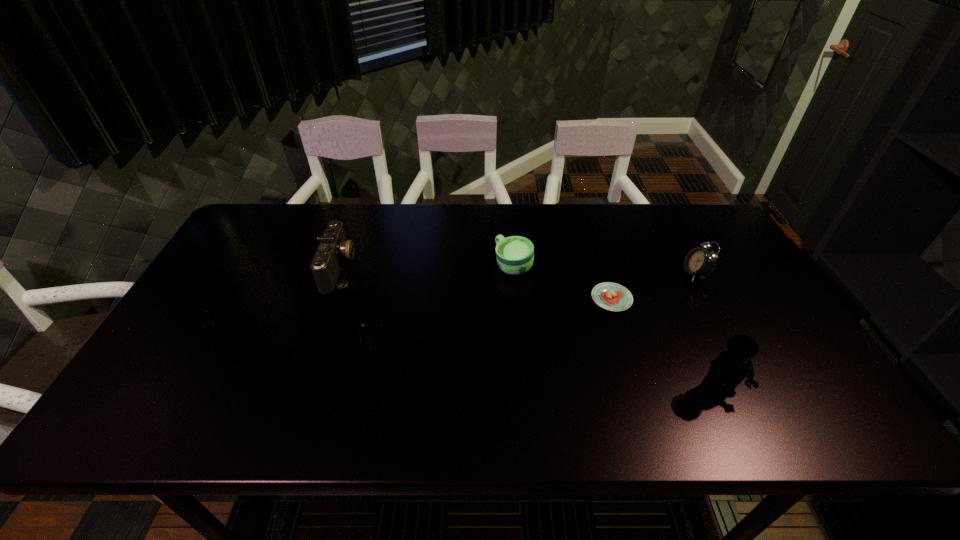
This screenshot has height=540, width=960. What are the coordinates of `the third object from right to left` in the screenshot? It's located at (611, 296).

At what (x,y) coordinates should I click in order to perform the action: click on the shortest object. Please return your answer as a coordinate pair (x, y). The height and width of the screenshot is (540, 960). Looking at the image, I should click on (611, 296).

Where is `vacant area situated 0.100m on the front-facing side of the shortest Lego`? vacant area situated 0.100m on the front-facing side of the shortest Lego is located at coordinates (171, 332).

Identify the location of vacant point located on the front-facing side of the second Lego from left to right. This screenshot has height=540, width=960. (441, 350).

Find the location of a particular element. This screenshot has width=960, height=540. free spot located 0.160m on the front-facing side of the sixth object from right to left is located at coordinates (408, 268).

The image size is (960, 540). I want to click on vacant area located on the face of the alarm clock, so click(609, 274).

At what (x,y) coordinates should I click in order to perform the action: click on free region located on the face of the alarm clock. Please return your answer as a coordinate pair (x, y). This screenshot has height=540, width=960. Looking at the image, I should click on (653, 274).

At what (x,y) coordinates should I click in order to perform the action: click on free space located on the face of the alarm clock. Please return your answer as a coordinate pair (x, y). The image size is (960, 540). Looking at the image, I should click on (636, 274).

This screenshot has width=960, height=540. Identify the location of free space located 0.370m on the left of the cup. (372, 266).

Where is `free location located on the left of the fifth object from left to right`? free location located on the left of the fifth object from left to right is located at coordinates pyautogui.click(x=544, y=299).